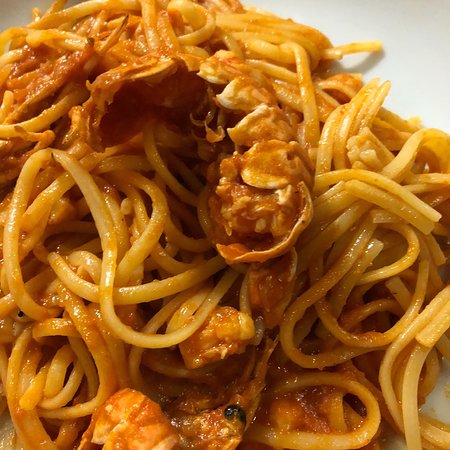
Identify the location of light. This screenshot has width=450, height=450. (97, 249).